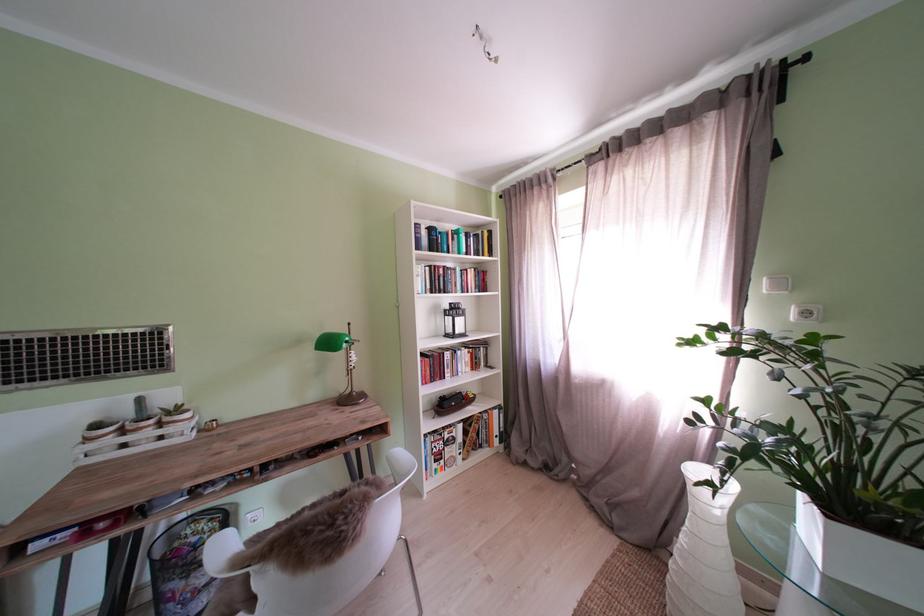
The width and height of the screenshot is (924, 616). Find the location of `white spiral vase`. white spiral vase is located at coordinates (703, 552).